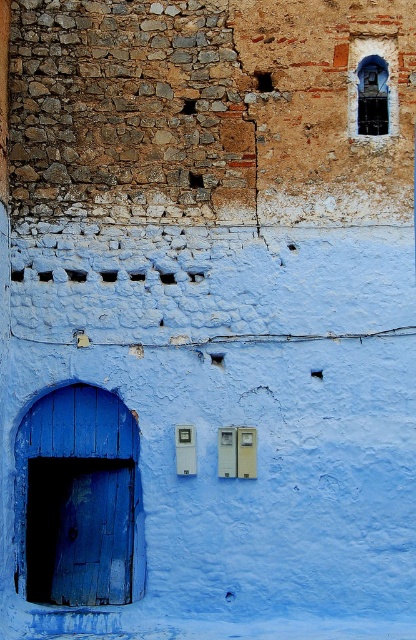
Question: Can you confirm if matte blue wooden door at left is smaller than dark blue stone window at upper right?

Choices:
 (A) yes
 (B) no

Answer: (B)

Question: Is dark blue stone window at upper right above dark glass window at upper right?

Choices:
 (A) no
 (B) yes

Answer: (B)

Question: Estimate the real-world distances between objects in this image. Which object is farther from the matte blue wooden door at left?

Choices:
 (A) dark glass window at upper right
 (B) dark blue stone window at upper right

Answer: (A)

Question: Can you confirm if matte blue wooden door at left is positioned to the left of dark glass window at upper right?

Choices:
 (A) no
 (B) yes

Answer: (B)

Question: Which of these objects is positioned farthest from the dark glass window at upper right?

Choices:
 (A) dark blue stone window at upper right
 (B) matte blue wooden door at left

Answer: (B)

Question: Among these objects, which one is nearest to the camera?

Choices:
 (A) matte blue wooden door at left
 (B) dark glass window at upper right

Answer: (B)